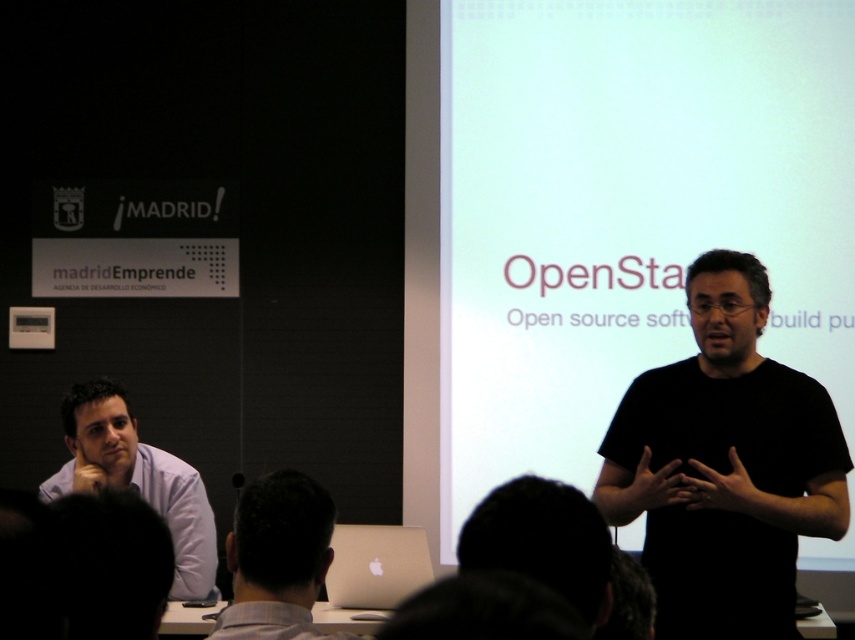
You are sitting in the audience of this presentation. You want to see the speaker clearly while also being able to view the projection screen. Which object should you move closer to, the light blue shirt at left or the white matte projection screen at center, to achieve both goals?

The light blue shirt at left is behind the white matte projection screen at center, so moving closer to the white matte projection screen at center will allow you to see both the speaker and the screen clearly without obstruction.